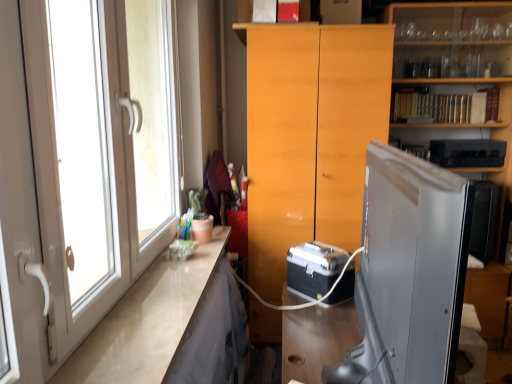
Question: From the image's perspective, would you say black plastic microwave at upper right, arranged as the 1th appliance when viewed from the top, is shown under white glossy counter top at left?

Choices:
 (A) no
 (B) yes

Answer: (A)

Question: Can you confirm if black plastic microwave at upper right, the 2th appliance when ordered from left to right, is wider than white glossy counter top at left?

Choices:
 (A) no
 (B) yes

Answer: (A)

Question: Is black plastic microwave at upper right, arranged as the 1th appliance when viewed from the back, smaller than white glossy counter top at left?

Choices:
 (A) no
 (B) yes

Answer: (B)

Question: Is the depth of black plastic microwave at upper right, acting as the 2th appliance starting from the bottom, less than that of white glossy counter top at left?

Choices:
 (A) yes
 (B) no

Answer: (B)

Question: Can white glossy counter top at left be found inside black plastic microwave at upper right, the 1th appliance when ordered from right to left?

Choices:
 (A) yes
 (B) no

Answer: (B)

Question: Does black plastic microwave at upper right, the 2th appliance when ordered from left to right, appear on the left side of white glossy counter top at left?

Choices:
 (A) no
 (B) yes

Answer: (A)

Question: Is metallic silver briefcase at center, which is counted as the 1th appliance, starting from the left, located outside white glossy door at left?

Choices:
 (A) no
 (B) yes

Answer: (B)

Question: Considering the relative sizes of metallic silver briefcase at center, the second appliance viewed from the right, and white glossy door at left in the image provided, is metallic silver briefcase at center, the second appliance viewed from the right, wider than white glossy door at left?

Choices:
 (A) no
 (B) yes

Answer: (B)

Question: Does metallic silver briefcase at center, which is counted as the 1th appliance, starting from the left, have a larger size compared to white glossy door at left?

Choices:
 (A) yes
 (B) no

Answer: (B)

Question: Could you tell me if metallic silver briefcase at center, acting as the 1th appliance starting from the bottom, is facing white glossy door at left?

Choices:
 (A) yes
 (B) no

Answer: (B)

Question: Is metallic silver briefcase at center, the second appliance from the back, looking in the opposite direction of white glossy door at left?

Choices:
 (A) yes
 (B) no

Answer: (B)

Question: From a real-world perspective, is metallic silver briefcase at center, which is the 2th appliance from top to bottom, on top of white glossy door at left?

Choices:
 (A) no
 (B) yes

Answer: (A)

Question: Is metallic silver briefcase at center, the second appliance from the back, located outside white glossy counter top at left?

Choices:
 (A) yes
 (B) no

Answer: (A)